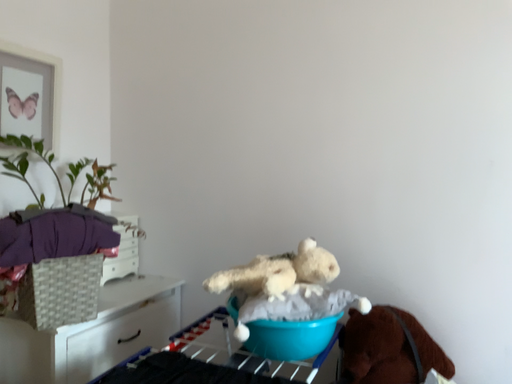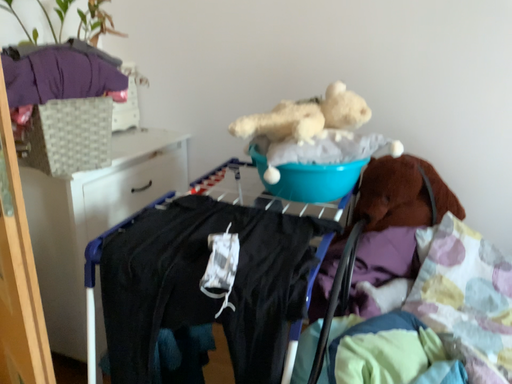
Question: How did the camera likely rotate when shooting the video?

Choices:
 (A) rotated upward
 (B) rotated downward

Answer: (B)